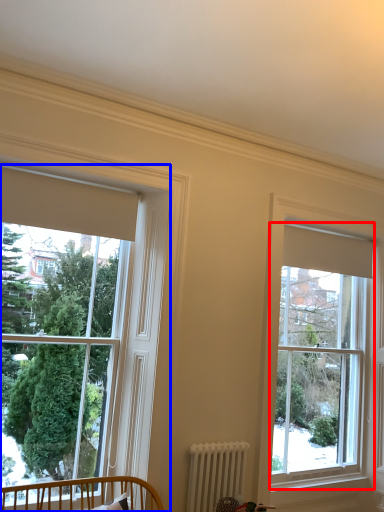
Question: Among these objects, which one is nearest to the camera, window (highlighted by a red box) or window (highlighted by a blue box)?

Choices:
 (A) window
 (B) window

Answer: (B)